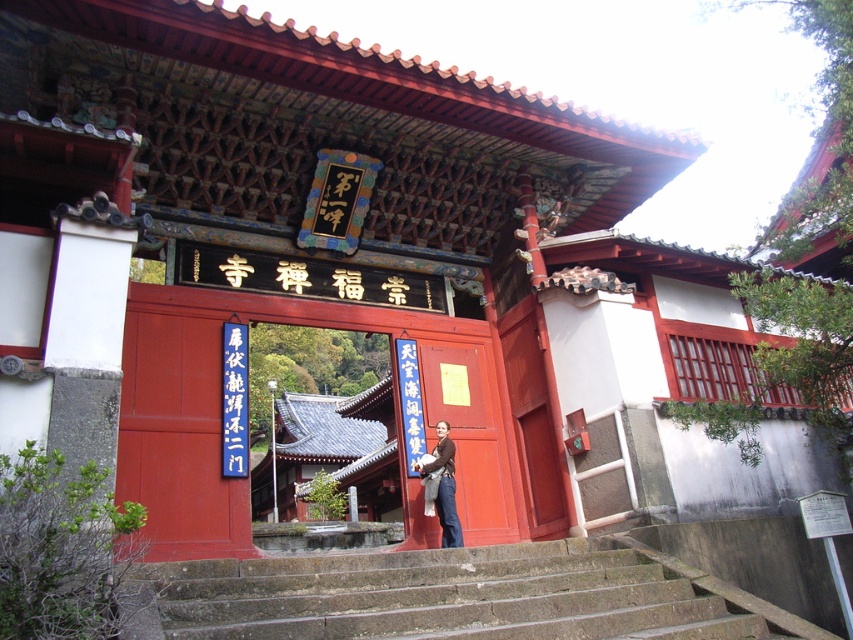
Is point (309, 580) positioned before point (424, 493)?

Yes.

Consider the image. Does concrete stairs at center have a lesser height compared to brown leather jacket at center?

In fact, concrete stairs at center may be taller than brown leather jacket at center.

This screenshot has height=640, width=853. What do you see at coordinates (456, 596) in the screenshot?
I see `concrete stairs at center` at bounding box center [456, 596].

The height and width of the screenshot is (640, 853). Identify the location of concrete stairs at center. (456, 596).

In the scene shown: Does concrete stairs at center have a lesser height compared to matte wood door at center?

In fact, concrete stairs at center may be taller than matte wood door at center.

Between concrete stairs at center and matte wood door at center, which one appears on the left side from the viewer's perspective?

Positioned to the left is concrete stairs at center.

Which is in front, point (573, 540) or point (476, 538)?

Point (573, 540) is more forward.

Locate an element on the screen. The image size is (853, 640). concrete stairs at center is located at coordinates (456, 596).

Is matte wood door at center below brown leather jacket at center?

No, matte wood door at center is not below brown leather jacket at center.

Which is behind, point (462, 426) or point (439, 429)?

The point (462, 426) is more distant.

What are the coordinates of `matte wood door at center` in the screenshot? It's located at tap(469, 432).